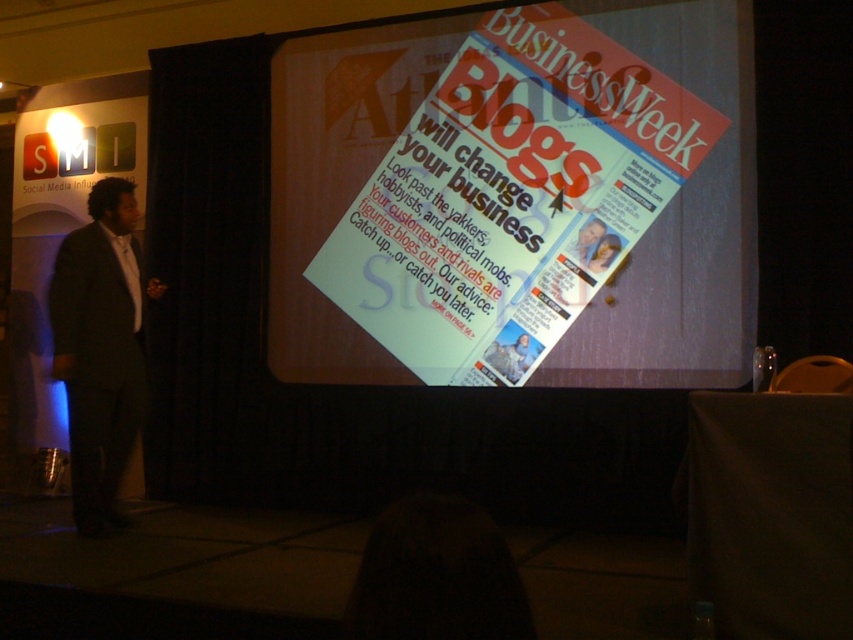
Is point (526, 378) in front of point (80, 362)?

No, (526, 378) is further to viewer.

Which is above, matte paper magazine at center or dark gray suit at left?

matte paper magazine at center

Between point (473, 99) and point (102, 220), which one is positioned behind?

Positioned behind is point (473, 99).

The height and width of the screenshot is (640, 853). What are the coordinates of `matte paper magazine at center` in the screenshot? It's located at (514, 198).